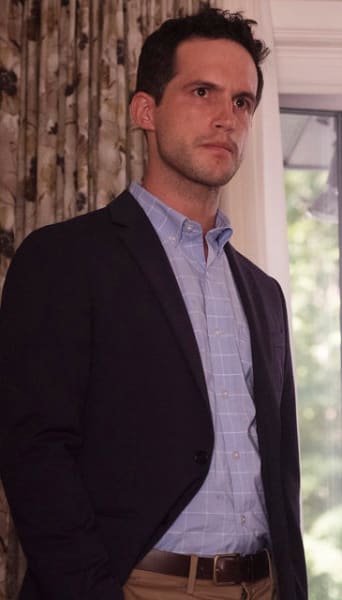
The image size is (342, 600). I want to click on curtains, so click(85, 80), click(269, 184).